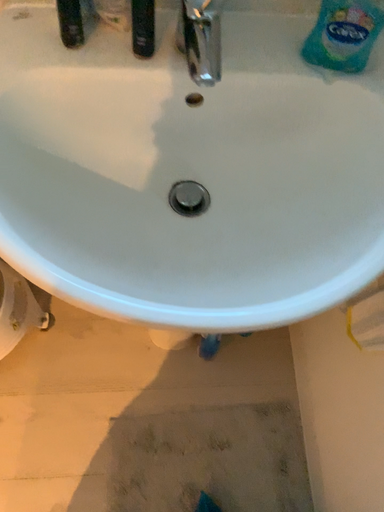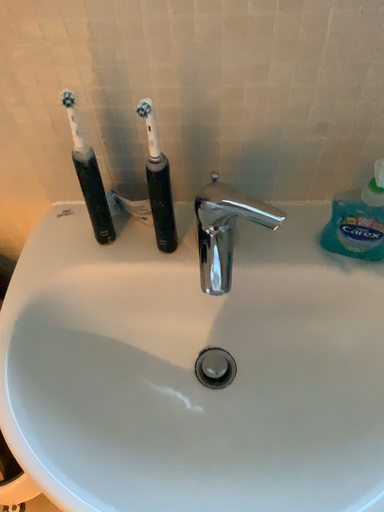
Question: Which way did the camera rotate in the video?

Choices:
 (A) rotated upward
 (B) rotated downward

Answer: (A)